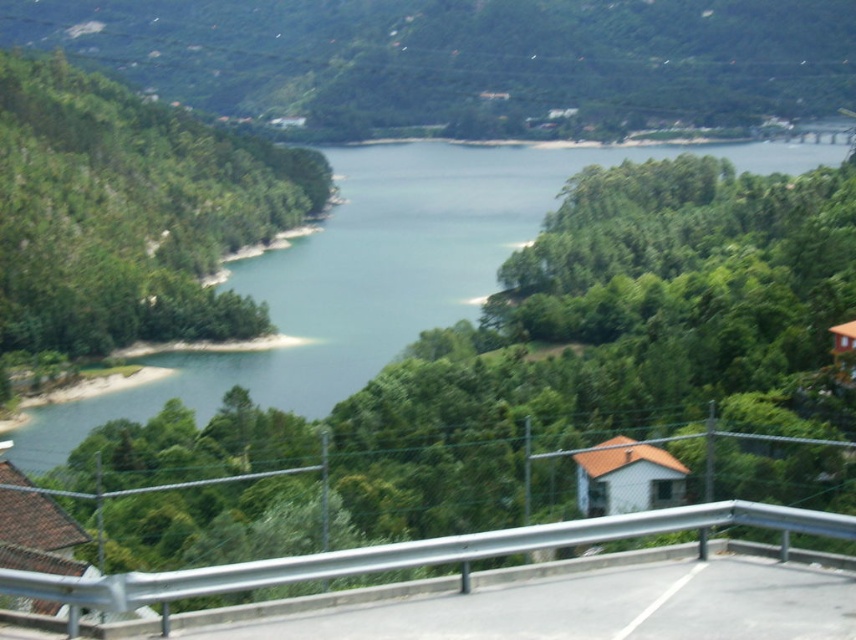
You are driving a car and want to cross the bridge over the lake. The car has a width of 2 meters. Can the car safely pass through the gap between the green water at center and the silver metallic guardrail at center?

The green water at center is bigger than the silver metallic guardrail at center, but the exact dimensions of the gap aren

You are standing at the viewpoint overlooking the lake and want to know how far the point at coordinates point (314,264) is from your current position. Can you determine the distance?

The point at coordinates point (314,264) is 1236.20 feet away from your current position.

Based on the photo, you are driving a car that is 1.8 meters wide. You need to cross a bridge where the road is bordered by a silver metallic guardrail at center. The green water at center is visible below. Can your car fit between the guardrail and the opposite side of the road?

The green water at center might be wider than the silver metallic guardrail at center. However, since the exact width of the road isn not provided, it is uncertain if the car can fit. Please check the road width before proceeding.